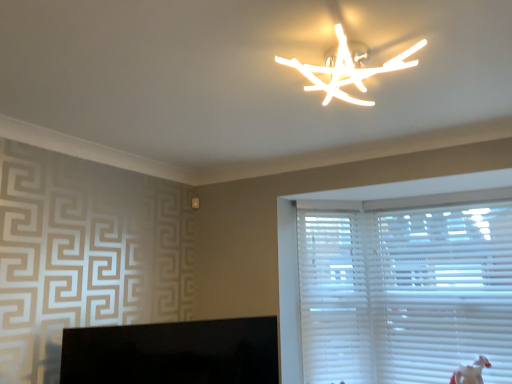
Question: Is white plastic blinds at right located within black glossy monitor at lower left?

Choices:
 (A) no
 (B) yes

Answer: (A)

Question: Is black glossy monitor at lower left smaller than white plastic blinds at right?

Choices:
 (A) no
 (B) yes

Answer: (B)

Question: Is black glossy monitor at lower left behind white plastic blinds at right?

Choices:
 (A) yes
 (B) no

Answer: (B)

Question: Considering the relative sizes of black glossy monitor at lower left and white plastic blinds at right in the image provided, is black glossy monitor at lower left shorter than white plastic blinds at right?

Choices:
 (A) yes
 (B) no

Answer: (A)

Question: Considering the relative sizes of black glossy monitor at lower left and white plastic blinds at right in the image provided, is black glossy monitor at lower left taller than white plastic blinds at right?

Choices:
 (A) yes
 (B) no

Answer: (B)

Question: From the image's perspective, relative to white plastic blinds at right, is white plastic blinds at right above or below?

Choices:
 (A) above
 (B) below

Answer: (B)

Question: From a real-world perspective, is white plastic blinds at right physically located above or below white plastic blinds at right?

Choices:
 (A) above
 (B) below

Answer: (A)

Question: Considering their positions, is white plastic blinds at right located in front of or behind white plastic blinds at right?

Choices:
 (A) behind
 (B) front

Answer: (A)

Question: In terms of height, does white plastic blinds at right look taller or shorter compared to white plastic blinds at right?

Choices:
 (A) tall
 (B) short

Answer: (B)

Question: From a real-world perspective, is white plastic blinds at right physically located above or below white plastic blinds at right?

Choices:
 (A) above
 (B) below

Answer: (B)

Question: In the image, is white plastic blinds at right on the left side or the right side of white plastic blinds at right?

Choices:
 (A) right
 (B) left

Answer: (A)

Question: Relative to white plastic blinds at right, is white plastic blinds at right in front or behind?

Choices:
 (A) behind
 (B) front

Answer: (B)

Question: Is white plastic blinds at right inside the boundaries of white plastic blinds at right, or outside?

Choices:
 (A) inside
 (B) outside

Answer: (B)

Question: Is point (222, 354) closer or farther from the camera than point (321, 354)?

Choices:
 (A) farther
 (B) closer

Answer: (B)

Question: In terms of size, does black glossy monitor at lower left appear bigger or smaller than white plastic blinds at right?

Choices:
 (A) big
 (B) small

Answer: (B)